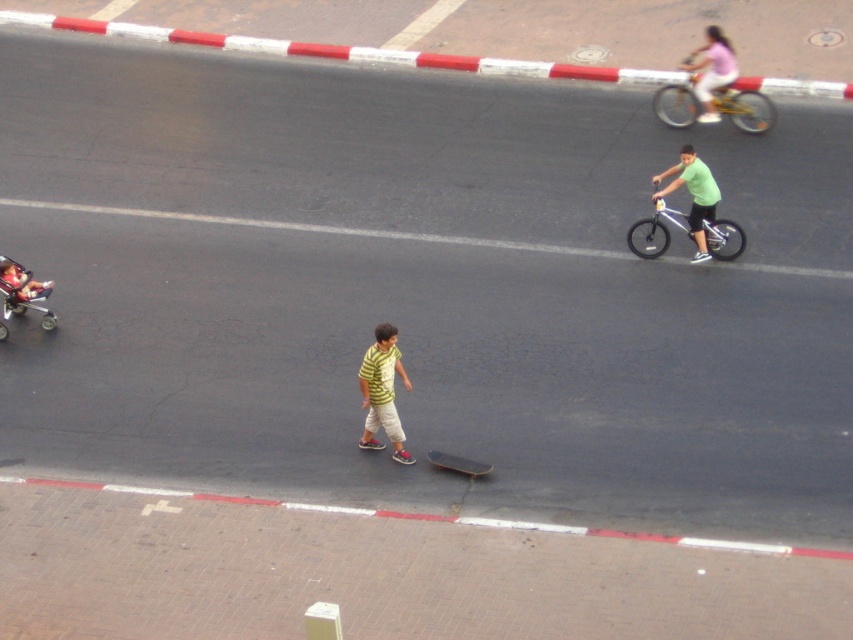
Question: Which of the following is the closest to the observer?

Choices:
 (A) green matte shirt at center
 (B) smooth black skateboard at center
 (C) silver metallic bicycle at center right

Answer: (B)

Question: Which point is farther to the camera?

Choices:
 (A) yellow metallic bicycle at upper right
 (B) silver metallic bicycle at center right
 (C) yellow striped shirt at center

Answer: (A)

Question: Does silver metallic bicycle at center right appear under metallic silver stroller at left?

Choices:
 (A) no
 (B) yes

Answer: (A)

Question: Among these objects, which one is nearest to the camera?

Choices:
 (A) yellow metallic bicycle at upper right
 (B) metallic silver stroller at left
 (C) green matte shirt at center

Answer: (B)

Question: Observing the image, what is the correct spatial positioning of yellow metallic bicycle at upper right in reference to metallic silver stroller at left?

Choices:
 (A) right
 (B) left

Answer: (A)

Question: Does metallic silver stroller at left appear over smooth black skateboard at center?

Choices:
 (A) yes
 (B) no

Answer: (A)